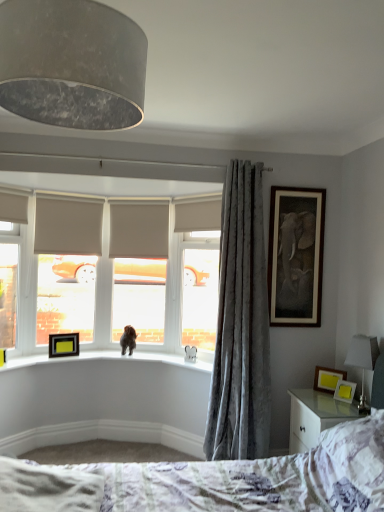
Identify the location of free space to the left of brown furry dog at window, the first animal positioned from the back. (109, 353).